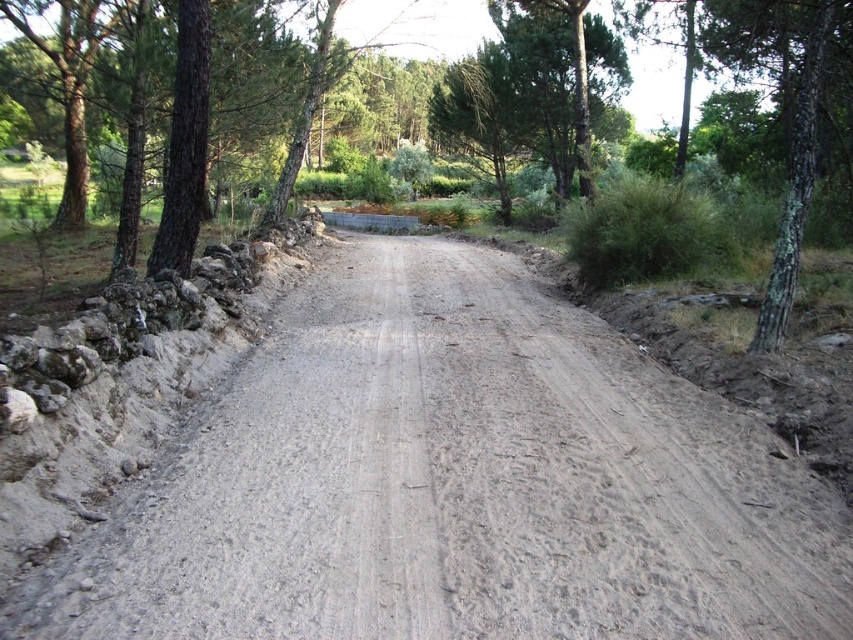
You are a hiker carrying a 2.5 meter wide tent. You need to set it up on the gray sandy dirt track at center or near the green rough bark tree at right. Based on their widths, where should you place the tent?

The gray sandy dirt track at center is wider than the green rough bark tree at right, so you should place the tent on the gray sandy dirt track at center since it can accommodate the 2.5 meter width.

From the picture: You are driving a truck that is 2.5 meters wide. You need to pass through the gray sandy dirt track at center and avoid hitting the green rough bark tree at right. Can your truck fit through the space between them without touching the tree?

The gray sandy dirt track at center and green rough bark tree at right are 2.22 meters apart. Since the truck is 2.5 meters wide, it is wider than the available space between them. Therefore, the truck cannot safely pass through without risking contact with the tree.

You are a hiker planning to walk along the gray sandy dirt track at center and the green rough bark tree at right. Which of these two features takes up more space in the image?

The green rough bark tree at right occupies more space than the gray sandy dirt track at center according to the description.